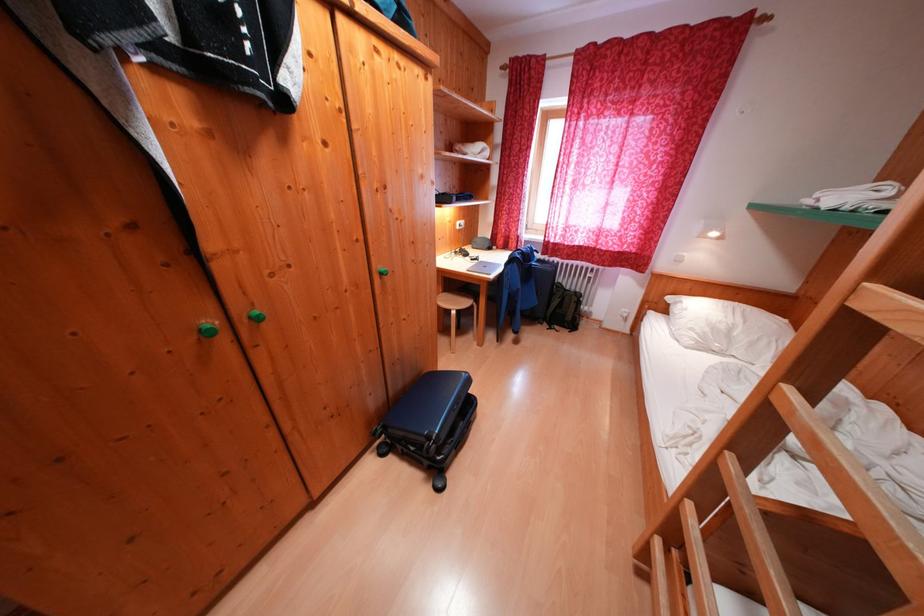
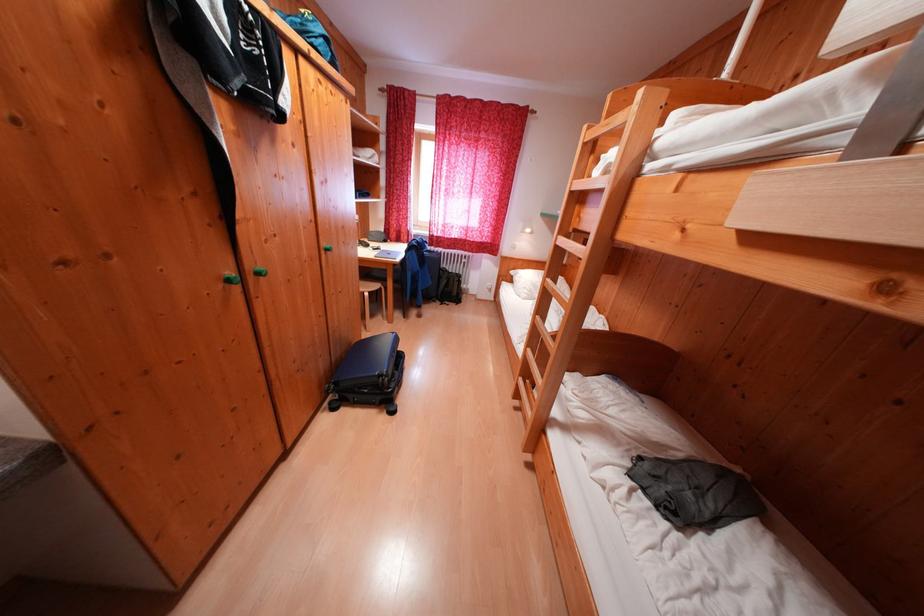
Locate, in the second image, the point that corresponds to the point at 446,439 in the first image.

(395, 376)